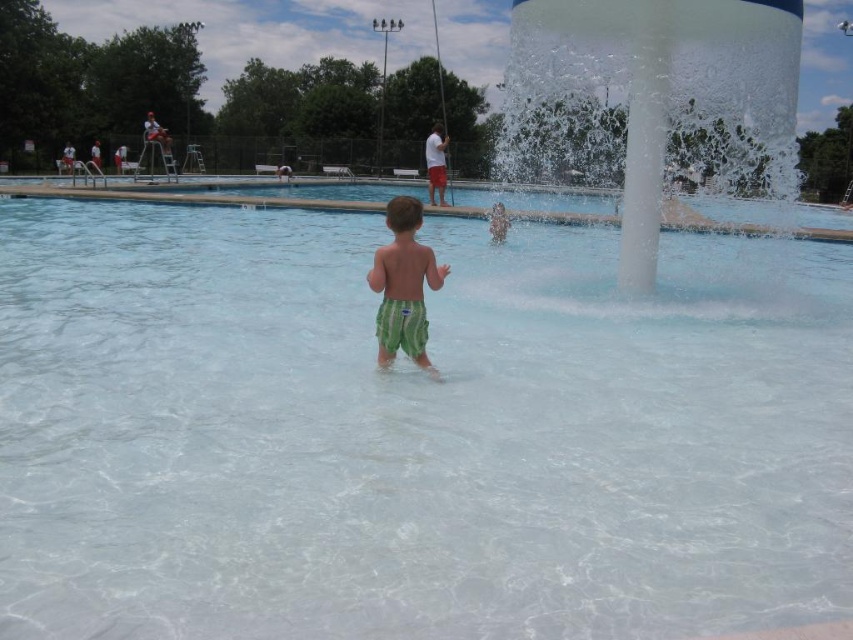
You are a swimmer approaching the pool and see the white translucent water at center and the green striped shorts at center. Which object is closer to you?

The white translucent water at center is closer to you because it is positioned further to the viewer than the green striped shorts at center.

In the scene shown: You are a swimmer who wants to jump into the pool safely. Considering the clear glass swimming pool at center and the white translucent water at center, which one should you avoid jumping into to prevent injury?

You should avoid jumping into the clear glass swimming pool at center because it has a lesser height compared to the white translucent water at center, making it potentially unsafe due to the depth being too shallow.